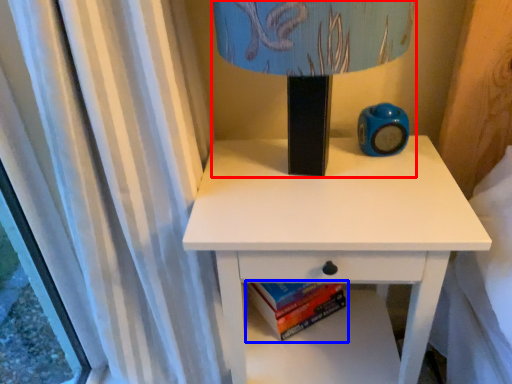
Question: Among these objects, which one is nearest to the camera, table lamp (highlighted by a red box) or paperback book (highlighted by a blue box)?

Choices:
 (A) table lamp
 (B) paperback book

Answer: (A)